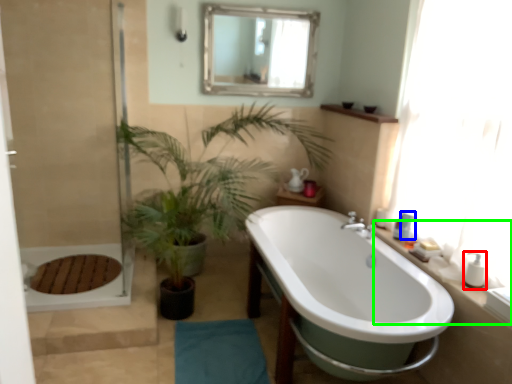
Question: Which object is the farthest from toiletry (highlighted by a red box)? Choose among these: toiletry (highlighted by a blue box) or counter top (highlighted by a green box).

Choices:
 (A) toiletry
 (B) counter top

Answer: (A)